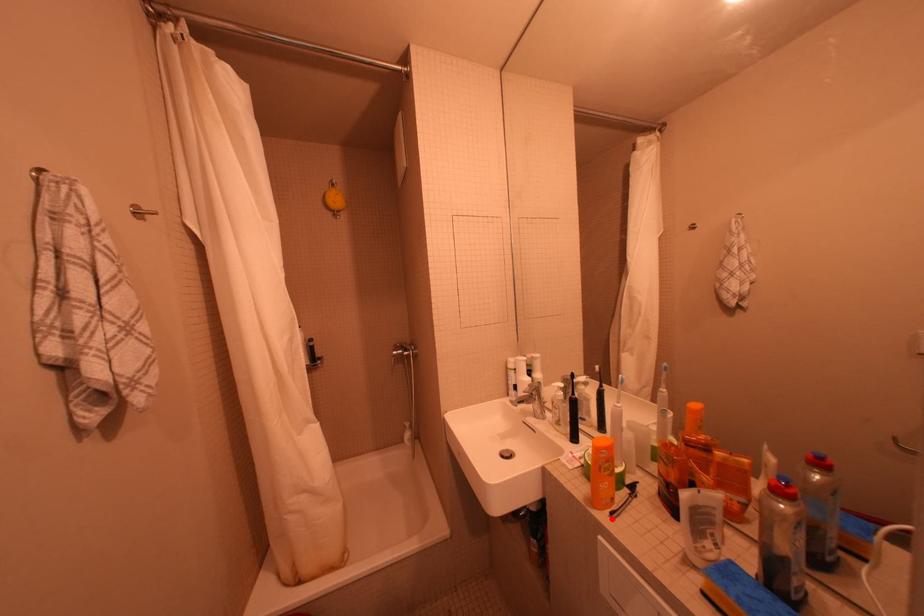
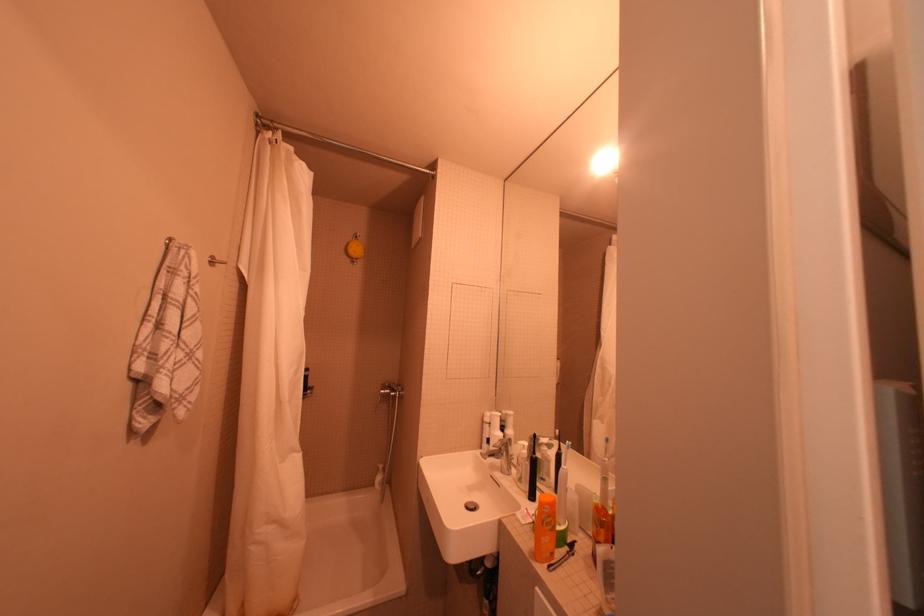
Locate, in the second image, the point that corresponds to the highlighted location in the first image.

(551, 570)